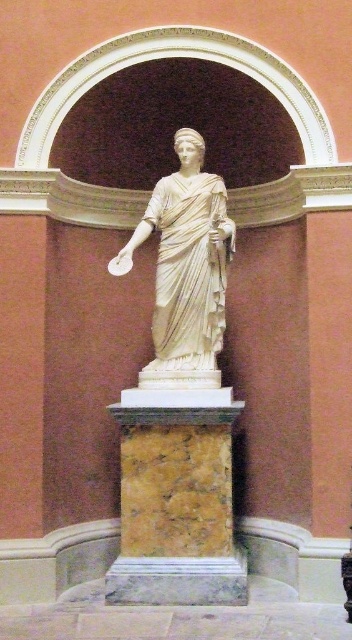
Question: Can you confirm if marble pedestal at center is positioned to the right of white marble statue at center?

Choices:
 (A) no
 (B) yes

Answer: (A)

Question: Which object is farther from the camera taking this photo?

Choices:
 (A) marble pedestal at center
 (B) white marble statue at center

Answer: (B)

Question: Can you confirm if marble pedestal at center is positioned below white marble statue at center?

Choices:
 (A) no
 (B) yes

Answer: (B)

Question: Is marble pedestal at center bigger than white marble statue at center?

Choices:
 (A) yes
 (B) no

Answer: (B)

Question: Which point is farther from the camera taking this photo?

Choices:
 (A) (223, 305)
 (B) (180, 442)

Answer: (A)